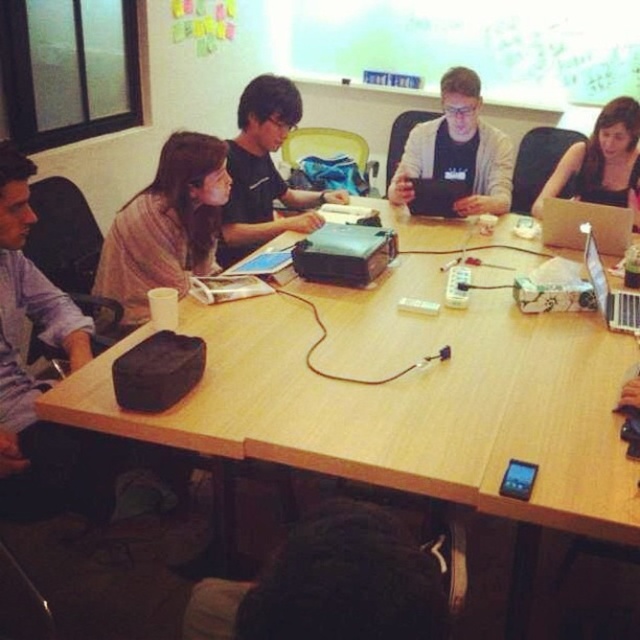
Question: Estimate the real-world distances between objects in this image. Which object is closer to the matte black laptop at center?

Choices:
 (A) satin silver laptop at upper right
 (B) matte black laptop at upper right
 (C) light brown fabric shirt at center-left

Answer: (A)

Question: Estimate the real-world distances between objects in this image. Which object is closer to the black matte shirt at center?

Choices:
 (A) satin silver laptop at upper right
 (B) silver metallic laptop at upper right
 (C) wooden table at center
 (D) matte black laptop at upper right

Answer: (C)

Question: Is silver metallic laptop at upper right wider than matte black laptop at center?

Choices:
 (A) no
 (B) yes

Answer: (A)

Question: In this image, where is black fabric bag at lower center located relative to matte black laptop at upper right?

Choices:
 (A) below
 (B) above

Answer: (A)

Question: Which of these objects is positioned farthest from the matte black laptop at upper right?

Choices:
 (A) satin silver laptop at upper right
 (B) silver metallic laptop at upper right

Answer: (B)

Question: Does wooden table at center have a larger size compared to white matte shirt at center?

Choices:
 (A) yes
 (B) no

Answer: (A)